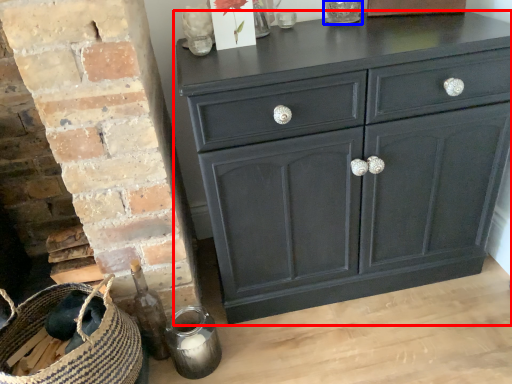
Question: Which object appears closest to the camera in this image, chest of drawers (highlighted by a red box) or glass vase (highlighted by a blue box)?

Choices:
 (A) chest of drawers
 (B) glass vase

Answer: (A)